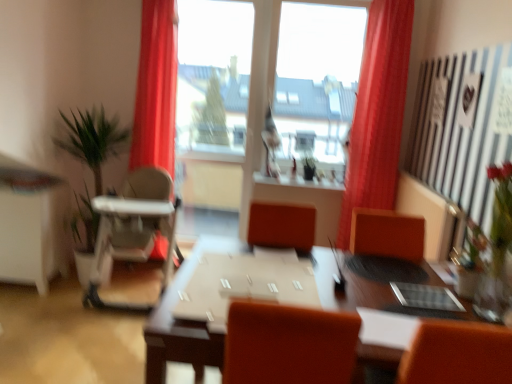
Locate an element on the screen. This screenshot has width=512, height=384. vacant area that lies between green leafy plant at left and white plastic high chair at left is located at coordinates (72, 294).